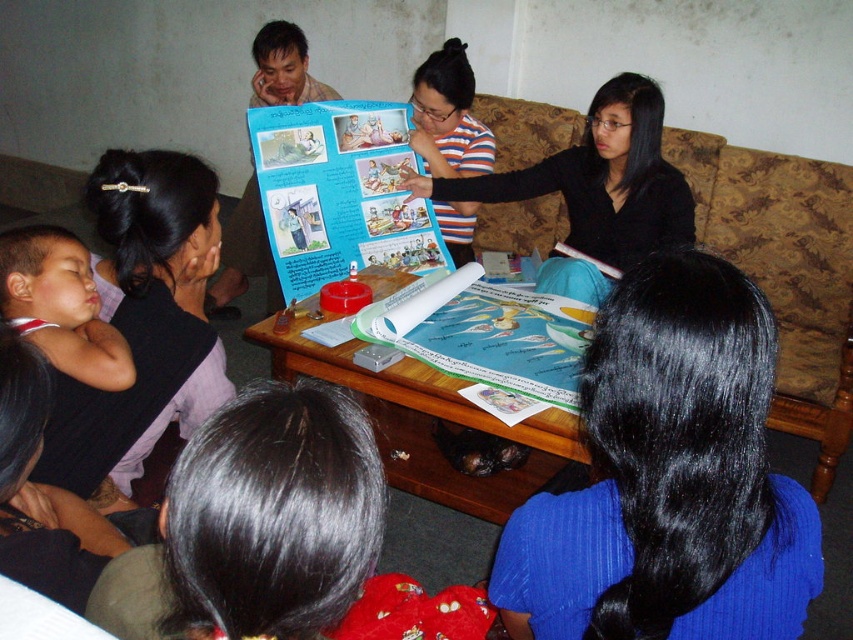
Does black matte poster at center have a lesser width compared to wooden table at center?

No, black matte poster at center is not thinner than wooden table at center.

Is point (509, 184) farther from camera compared to point (428, 490)?

Yes, it is.

Find the location of a particular element. black matte poster at center is located at coordinates (598, 179).

Does blue fabric hair at lower right appear over wooden table at center?

No, blue fabric hair at lower right is not above wooden table at center.

Who is positioned more to the left, blue fabric hair at lower right or wooden table at center?

wooden table at center

Between point (699, 444) and point (376, 408), which one is positioned behind?

The point (376, 408) is more distant.

The height and width of the screenshot is (640, 853). Find the location of `blue fabric hair at lower right`. blue fabric hair at lower right is located at coordinates (668, 477).

Which of these two, blue fabric hair at lower right or black matte poster at center, stands taller?

black matte poster at center

At what (x,y) coordinates should I click in order to perform the action: click on blue fabric hair at lower right. Please return your answer as a coordinate pair (x, y). The image size is (853, 640). Looking at the image, I should click on (668, 477).